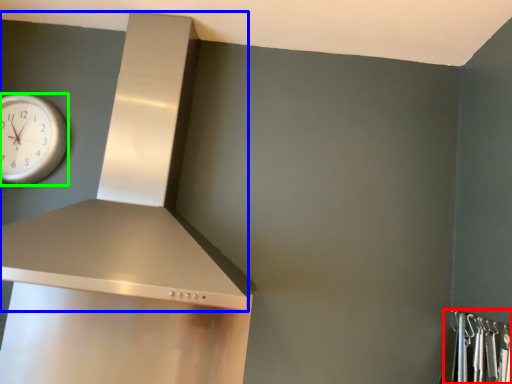
Question: Which object is positioned farthest from closet (highlighted by a red box)? Select from vent (highlighted by a blue box) and wall clock (highlighted by a green box).

Choices:
 (A) vent
 (B) wall clock

Answer: (B)